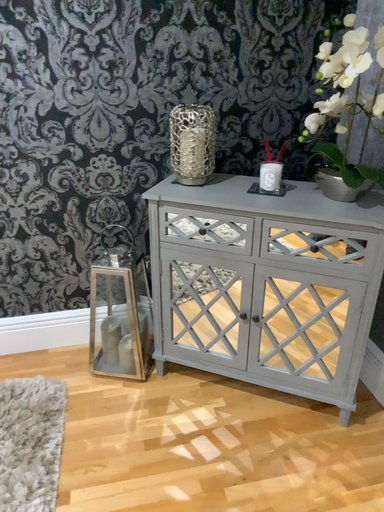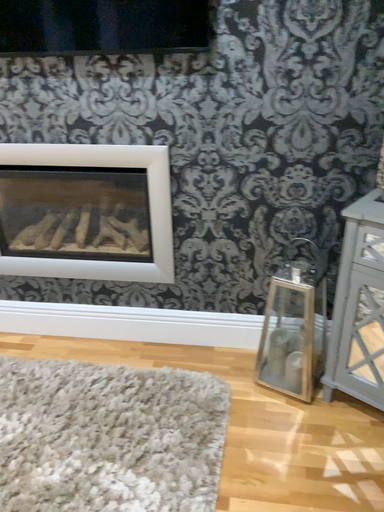
Question: How did the camera likely rotate when shooting the video?

Choices:
 (A) rotated right
 (B) rotated left

Answer: (B)